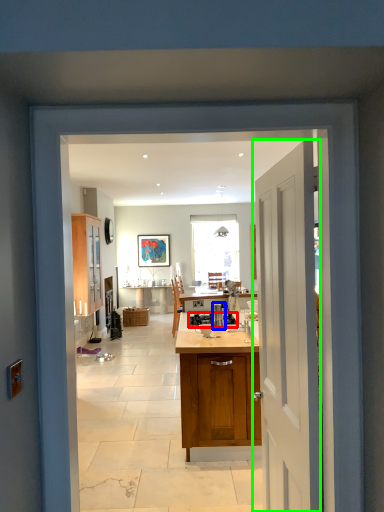
Question: Based on their relative distances, which object is farther from appliance (highlighted by a red box)? Choose from kitchen appliance (highlighted by a blue box) and door (highlighted by a green box).

Choices:
 (A) kitchen appliance
 (B) door

Answer: (B)